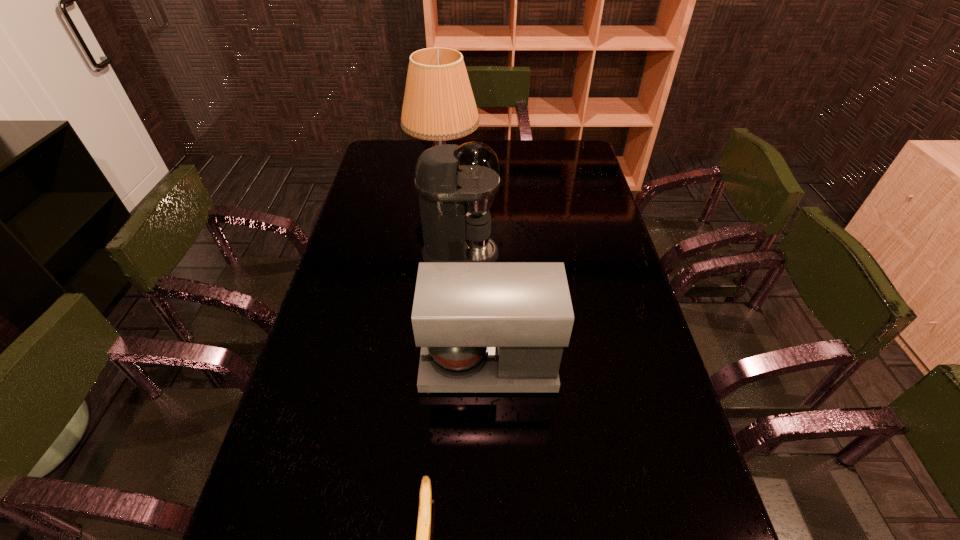
Locate an element on the screen. The image size is (960, 540). the farthest object is located at coordinates (438, 105).

At what (x,y) coordinates should I click in order to perform the action: click on lamp. Please return your answer as a coordinate pair (x, y). Looking at the image, I should click on (438, 105).

Locate an element on the screen. Image resolution: width=960 pixels, height=540 pixels. the taller coffee maker is located at coordinates (456, 185).

The image size is (960, 540). Identify the location of the second tallest object. (456, 185).

In order to click on the second nearest object in this screenshot , I will do `click(483, 327)`.

Where is `the shorter coffee maker`? the shorter coffee maker is located at coordinates (483, 327).

You are a GUI agent. You are given a task and a screenshot of the screen. Output one action in this format:
    pyautogui.click(x=<x>, y=<y>)
    Task: Click on the blank area located 0.330m on the side of the lamp near the pull switch
    Image resolution: width=960 pixels, height=540 pixels.
    Given the screenshot: What is the action you would take?
    pyautogui.click(x=564, y=183)

I want to click on vacant area situated place cup under the spout of the taller coffee maker, so click(x=606, y=254).

Find the location of `vacant space located on the carafe side of the nearer coffee maker`. vacant space located on the carafe side of the nearer coffee maker is located at coordinates (375, 363).

The width and height of the screenshot is (960, 540). Identify the location of vacant space situated 0.050m on the carafe side of the nearer coffee maker. (402, 363).